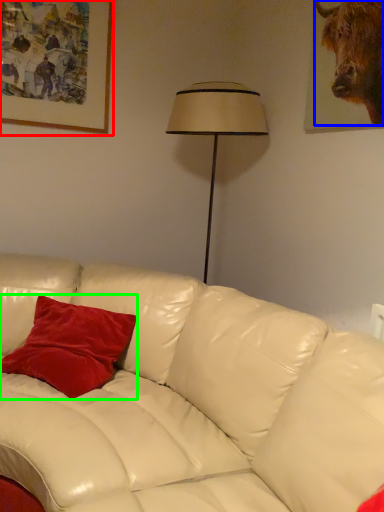
Question: Which is nearer to the picture frame (highlighted by a red box)? bull (highlighted by a blue box) or pillow (highlighted by a green box).

Choices:
 (A) bull
 (B) pillow

Answer: (B)